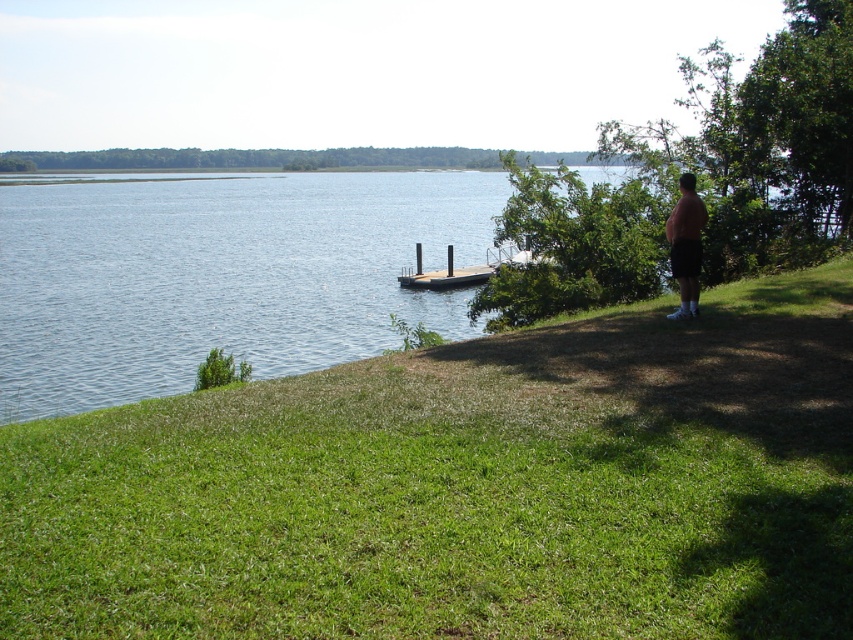
Question: Among these objects, which one is nearest to the camera?

Choices:
 (A) wooden dock at center
 (B) pink cotton shirt at right

Answer: (B)

Question: Which point appears closest to the camera in this image?

Choices:
 (A) (65, 573)
 (B) (697, 227)

Answer: (A)

Question: Is green grassy at lower left smaller than wooden dock at center?

Choices:
 (A) yes
 (B) no

Answer: (B)

Question: Which point is farther to the camera?

Choices:
 (A) pink cotton shirt at right
 (B) wooden dock at center
 (C) green grassy at lower left

Answer: (B)

Question: Is green grassy at lower left to the right of wooden dock at center from the viewer's perspective?

Choices:
 (A) no
 (B) yes

Answer: (B)

Question: Is pink cotton shirt at right thinner than wooden dock at center?

Choices:
 (A) yes
 (B) no

Answer: (A)